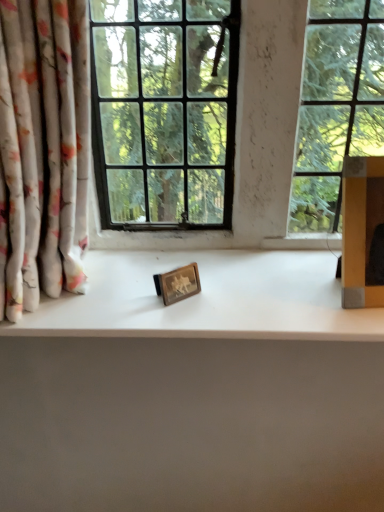
What do you see at coordinates (178, 283) in the screenshot? I see `wooden picture frame at center` at bounding box center [178, 283].

Describe the element at coordinates (43, 150) in the screenshot. I see `floral fabric curtain at left` at that location.

You are a GUI agent. You are given a task and a screenshot of the screen. Output one action in this format:
    pyautogui.click(x=<x>, y=<y>)
    Task: Click on the wooden picture frame at center
    This screenshot has width=384, height=512.
    Given the screenshot: What is the action you would take?
    pyautogui.click(x=178, y=283)

Who is bigger, white matte counter top at center or wooden picture frame at center?

Bigger between the two is white matte counter top at center.

Is white matte counter top at center far away from wooden picture frame at center?

No.

Can you tell me how much white matte counter top at center and wooden picture frame at center differ in facing direction?

The angle between the facing direction of white matte counter top at center and the facing direction of wooden picture frame at center is 37.7 degrees.

Which object is closer to the camera, white matte counter top at center or wooden picture frame at center?

Positioned in front is white matte counter top at center.

Is yellow cardboard box at right looking in the opposite direction of wooden picture frame at center?

No, yellow cardboard box at right is not facing away from wooden picture frame at center.

Can you see yellow cardboard box at right touching wooden picture frame at center?

No, yellow cardboard box at right is not touching wooden picture frame at center.

Would you say yellow cardboard box at right is outside wooden picture frame at center?

Yes, yellow cardboard box at right is located beyond the bounds of wooden picture frame at center.

Is yellow cardboard box at right closer to the viewer compared to wooden picture frame at center?

That is True.

From the image's perspective, who appears lower, white matte counter top at center or yellow cardboard box at right?

white matte counter top at center is shown below in the image.

This screenshot has width=384, height=512. Find the location of `cardboard box in front of the white matte counter top at center`. cardboard box in front of the white matte counter top at center is located at coordinates (363, 232).

In the scene shown: Could you tell me if white matte counter top at center is facing yellow cardboard box at right?

No, white matte counter top at center is not turned towards yellow cardboard box at right.

Is white matte counter top at center positioned far away from yellow cardboard box at right?

They are positioned close to each other.

Can you confirm if wooden picture frame at center is wider than floral fabric curtain at left?

Incorrect, the width of wooden picture frame at center does not surpass that of floral fabric curtain at left.

Which object is positioned more to the right, wooden picture frame at center or floral fabric curtain at left?

wooden picture frame at center is more to the right.

Based on their sizes in the image, would you say wooden picture frame at center is bigger or smaller than floral fabric curtain at left?

In the image, wooden picture frame at center appears to be smaller than floral fabric curtain at left.

Is wooden picture frame at center positioned far away from white matte counter top at center?

Actually, wooden picture frame at center and white matte counter top at center are a little close together.

From a real-world perspective, which object rests below the other?

white matte counter top at center.

You are a GUI agent. You are given a task and a screenshot of the screen. Output one action in this format:
    pyautogui.click(x=<x>, y=<y>)
    Task: Click on the picture frame behind the white matte counter top at center
    The width and height of the screenshot is (384, 512).
    Given the screenshot: What is the action you would take?
    pyautogui.click(x=178, y=283)

Based on their positions, is wooden picture frame at center located to the left or right of white matte counter top at center?

From the image, it's evident that wooden picture frame at center is to the left of white matte counter top at center.

Looking at the image, does wooden picture frame at center seem bigger or smaller compared to yellow cardboard box at right?

wooden picture frame at center is smaller than yellow cardboard box at right.

From a real-world perspective, is wooden picture frame at center located beneath yellow cardboard box at right?

Yes, from a real-world perspective, wooden picture frame at center is beneath yellow cardboard box at right.

Is wooden picture frame at center not near yellow cardboard box at right?

wooden picture frame at center is actually quite close to yellow cardboard box at right.

From the image's perspective, is floral fabric curtain at left beneath white matte counter top at center?

No, from the image's perspective, floral fabric curtain at left is not beneath white matte counter top at center.

Can you tell me how much floral fabric curtain at left and white matte counter top at center differ in facing direction?

floral fabric curtain at left and white matte counter top at center are facing 0.00174 degrees away from each other.

Looking at this image, does floral fabric curtain at left touch white matte counter top at center?

No, floral fabric curtain at left is not touching white matte counter top at center.

Which of these two, floral fabric curtain at left or white matte counter top at center, stands shorter?

white matte counter top at center is shorter.

Where is `counter top beneath the wooden picture frame at center (from a real-world perspective)`? counter top beneath the wooden picture frame at center (from a real-world perspective) is located at coordinates (207, 298).

This screenshot has width=384, height=512. I want to click on cardboard box that appears above the wooden picture frame at center (from a real-world perspective), so click(363, 232).

Looking at the image, which one is located closer to yellow cardboard box at right, floral fabric curtain at left or white matte counter top at center?

white matte counter top at center is positioned closer to the anchor yellow cardboard box at right.

Based on their spatial positions, is floral fabric curtain at left or yellow cardboard box at right closer to wooden picture frame at center?

The object closer to wooden picture frame at center is floral fabric curtain at left.

Looking at this image, considering their positions, is white matte counter top at center positioned further to wooden picture frame at center than floral fabric curtain at left?

floral fabric curtain at left is positioned further to the anchor wooden picture frame at center.

Considering their positions, is white matte counter top at center positioned closer to wooden picture frame at center than yellow cardboard box at right?

Among the two, white matte counter top at center is located nearer to wooden picture frame at center.

Considering their positions, is floral fabric curtain at left positioned further to white matte counter top at center than wooden picture frame at center?

Based on the image, floral fabric curtain at left appears to be further to white matte counter top at center.

Consider the image. Estimate the real-world distances between objects in this image. Which object is closer to floral fabric curtain at left, wooden picture frame at center or yellow cardboard box at right?

wooden picture frame at center lies closer to floral fabric curtain at left than the other object.

From the image, which object appears to be nearer to white matte counter top at center, yellow cardboard box at right or wooden picture frame at center?

wooden picture frame at center lies closer to white matte counter top at center than the other object.

When comparing their distances from yellow cardboard box at right, does white matte counter top at center or floral fabric curtain at left seem closer?

Based on the image, white matte counter top at center appears to be nearer to yellow cardboard box at right.

I want to click on picture frame between floral fabric curtain at left and yellow cardboard box at right, so click(x=178, y=283).

The width and height of the screenshot is (384, 512). I want to click on counter top between floral fabric curtain at left and yellow cardboard box at right, so click(207, 298).

Find the location of a particular element. counter top located between wooden picture frame at center and yellow cardboard box at right in the left-right direction is located at coordinates (207, 298).

This screenshot has width=384, height=512. I want to click on picture frame between floral fabric curtain at left and white matte counter top at center in the horizontal direction, so click(x=178, y=283).